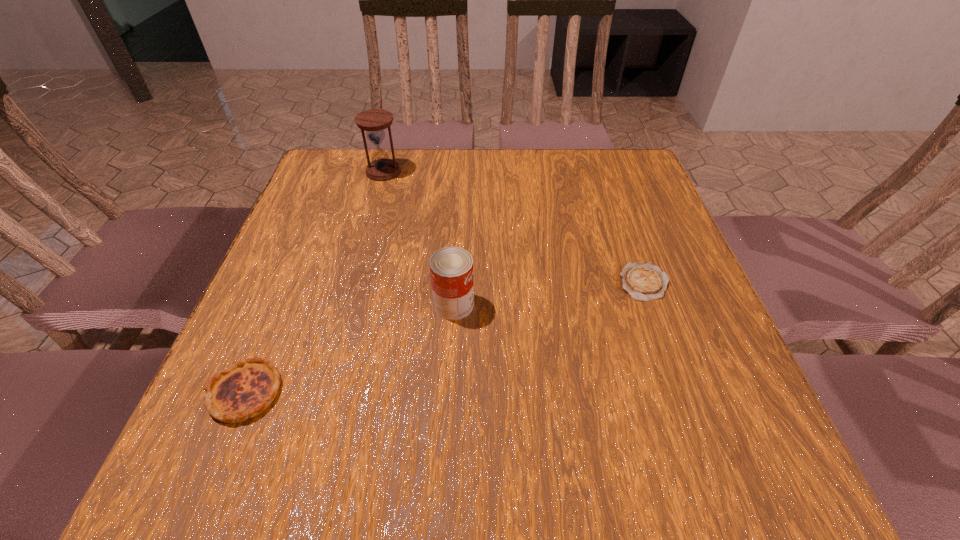
The height and width of the screenshot is (540, 960). Find the location of `empty space that is in between the leftmost object and the third shortest object`. empty space that is in between the leftmost object and the third shortest object is located at coordinates (349, 349).

Where is `vacant area that lies between the tallest object and the nearer quiche`? Image resolution: width=960 pixels, height=540 pixels. vacant area that lies between the tallest object and the nearer quiche is located at coordinates (315, 282).

Where is `free point between the left quiche and the second tallest object`? free point between the left quiche and the second tallest object is located at coordinates (349, 349).

Where is `empty location between the leftmost object and the can`? The height and width of the screenshot is (540, 960). empty location between the leftmost object and the can is located at coordinates (349, 349).

This screenshot has height=540, width=960. I want to click on the closest object relative to the right quiche, so click(451, 268).

Identify the location of object that is the third closest to the farthest object. (644, 281).

The image size is (960, 540). Find the location of `free space in the image that satisfies the following two spatial constraints: 1. on the back side of the shorter quiche; 2. on the right side of the third tallest object`. free space in the image that satisfies the following two spatial constraints: 1. on the back side of the shorter quiche; 2. on the right side of the third tallest object is located at coordinates (291, 283).